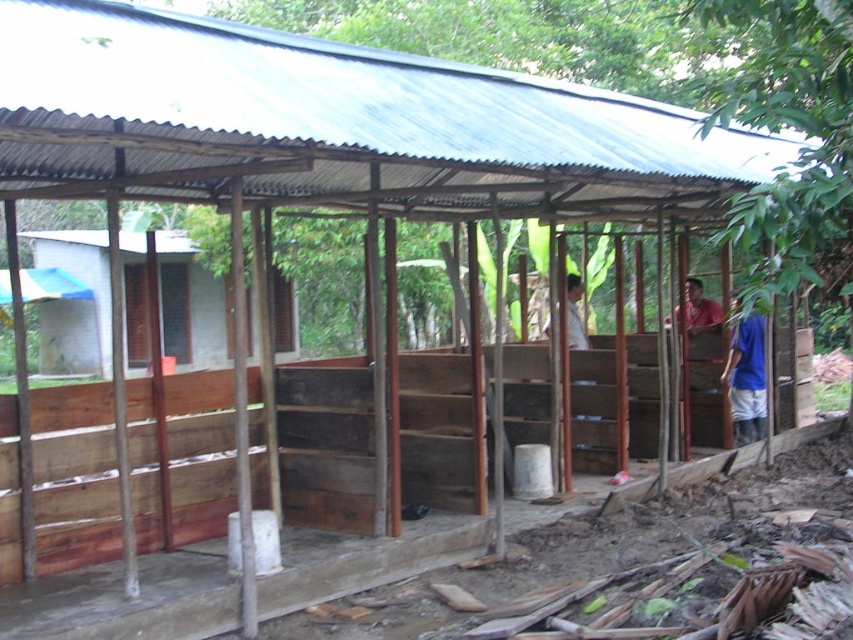
Question: Which point is closer to the camera taking this photo?

Choices:
 (A) (763, 408)
 (B) (579, 328)
 (C) (715, 301)

Answer: (B)

Question: Among these points, which one is nearest to the camera?

Choices:
 (A) (757, 394)
 (B) (691, 296)
 (C) (572, 330)

Answer: (C)

Question: Is red shirt at right wider than light brown wooden bench at center?

Choices:
 (A) yes
 (B) no

Answer: (A)

Question: Which point is farther to the camera?

Choices:
 (A) light brown wooden bench at center
 (B) blue fabric shirt at right
 (C) red shirt at right

Answer: (C)

Question: Can you confirm if blue fabric shirt at right is positioned above light brown wooden bench at center?

Choices:
 (A) no
 (B) yes

Answer: (A)

Question: Considering the relative positions of red shirt at right and blue fabric shirt at right in the image provided, where is red shirt at right located with respect to blue fabric shirt at right?

Choices:
 (A) below
 (B) above

Answer: (B)